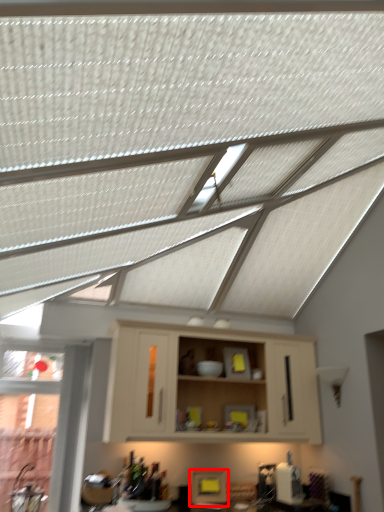
Question: From the image's perspective, where is appliance (annotated by the red box) located in relation to cabinetry in the image?

Choices:
 (A) above
 (B) below

Answer: (B)